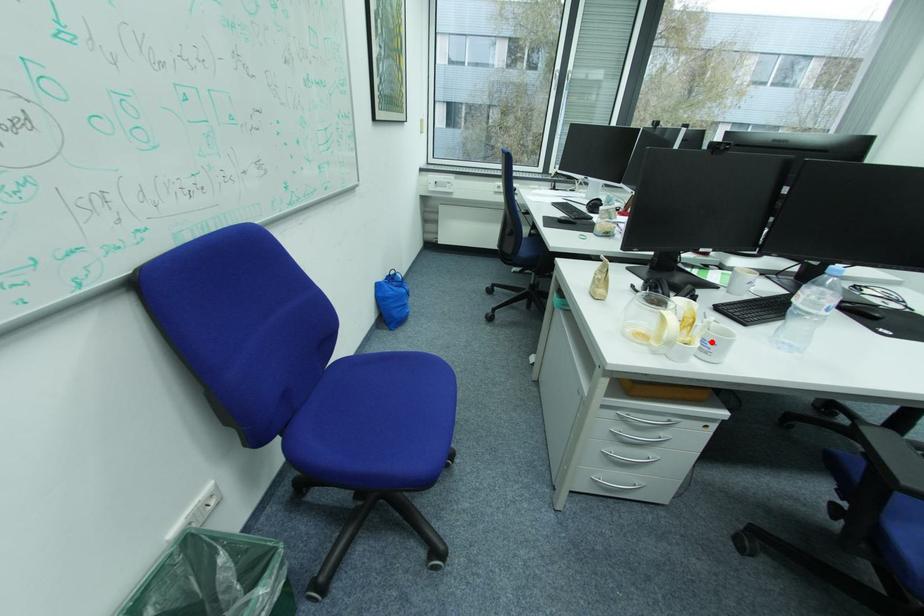
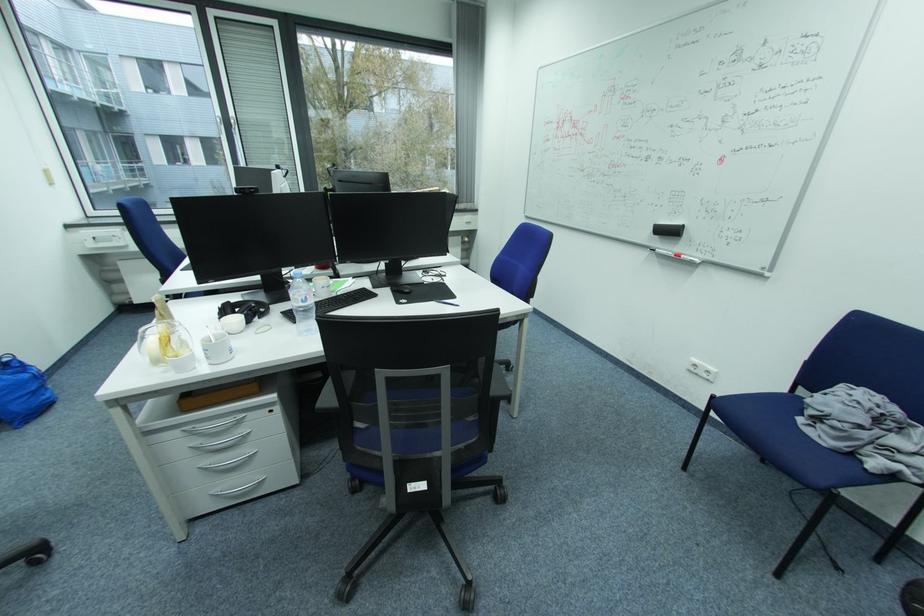
Where in the second image is the point corresponding to the highlighted location from the first image?

(213, 351)